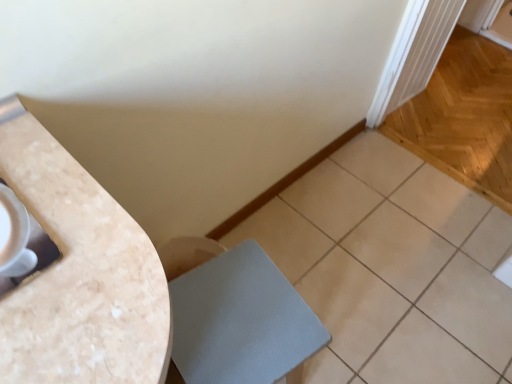
The height and width of the screenshot is (384, 512). I want to click on free point above gray matte stool at lower center (from a real-world perspective), so click(x=239, y=316).